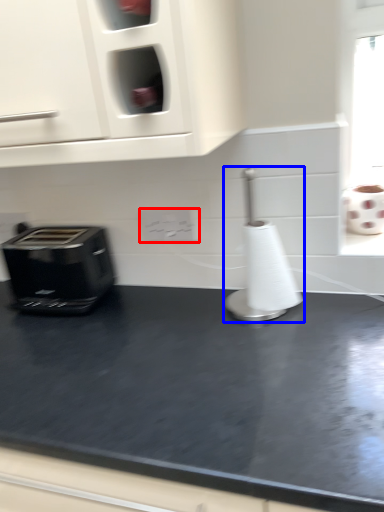
Question: Which object is further to the camera taking this photo, electric outlet (highlighted by a red box) or appliance (highlighted by a blue box)?

Choices:
 (A) electric outlet
 (B) appliance

Answer: (A)